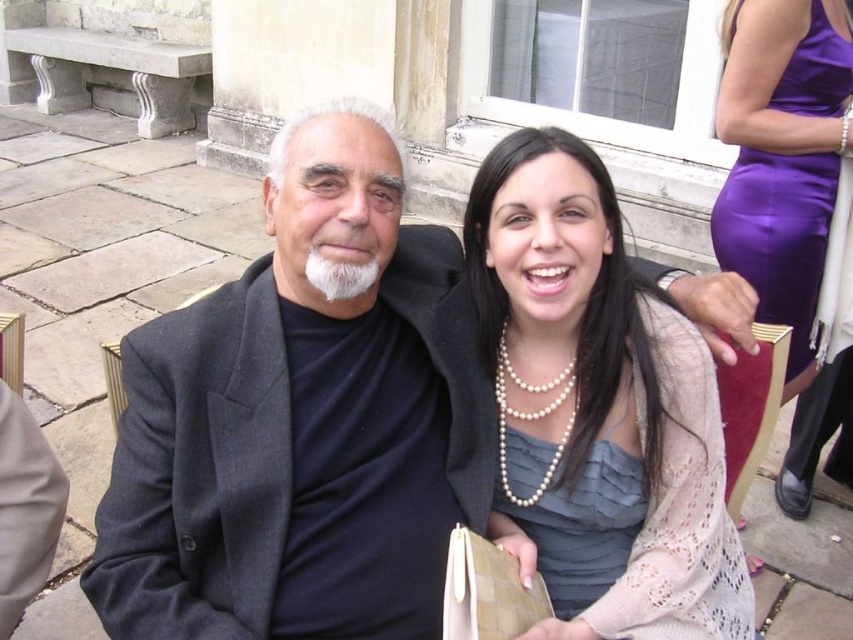
Which is more to the right, purple satin dress at right or gray satin dress at center?

Positioned to the right is purple satin dress at right.

From the picture: Is purple satin dress at right wider than gray satin dress at center?

Yes, purple satin dress at right is wider than gray satin dress at center.

Measure the distance between point (831, 212) and camera.

Point (831, 212) is 2.45 meters away from camera.

The image size is (853, 640). What are the coordinates of `purple satin dress at right` in the screenshot? It's located at (781, 154).

Which is below, dark gray suit at center or purple satin dress at right?

Positioned lower is dark gray suit at center.

The width and height of the screenshot is (853, 640). What do you see at coordinates (305, 420) in the screenshot?
I see `dark gray suit at center` at bounding box center [305, 420].

You are a GUI agent. You are given a task and a screenshot of the screen. Output one action in this format:
    pyautogui.click(x=<x>, y=<y>)
    Task: Click on the dark gray suit at center
    
    Given the screenshot: What is the action you would take?
    pyautogui.click(x=305, y=420)

Which is below, pearl necklace at center or purple satin dress at right?

Positioned lower is pearl necklace at center.

Who is higher up, pearl necklace at center or purple satin dress at right?

purple satin dress at right

Where is `pearl necklace at center`? The height and width of the screenshot is (640, 853). pearl necklace at center is located at coordinates (598, 406).

Find the location of a particular element. pearl necklace at center is located at coordinates (598, 406).